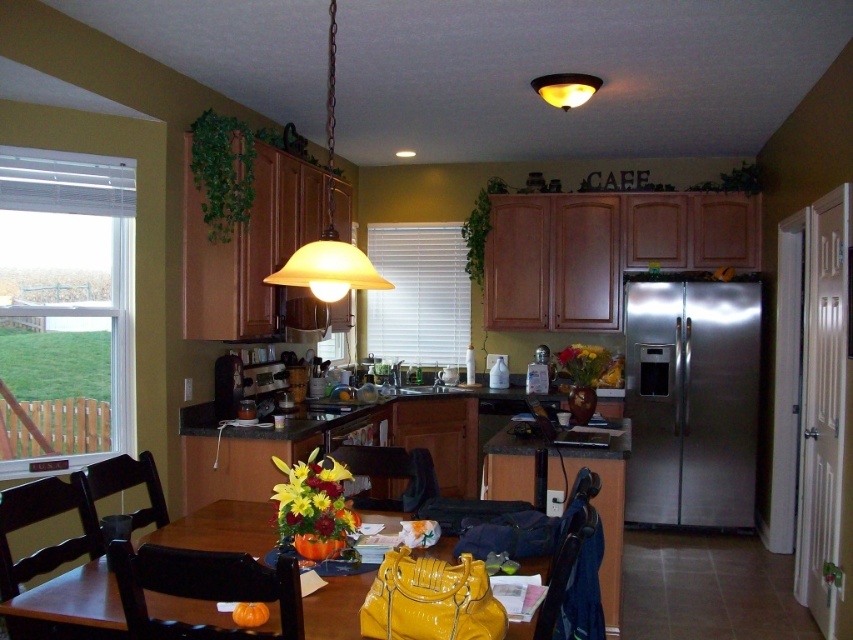
Question: Is matte glass pendant light at upper center above black wood chair at left?

Choices:
 (A) no
 (B) yes

Answer: (B)

Question: Does matte glass pendant light at upper center have a larger size compared to matte yellow glass pendant light at upper center?

Choices:
 (A) no
 (B) yes

Answer: (B)

Question: Among these points, which one is nearest to the camera?

Choices:
 (A) (706, 465)
 (B) (396, 504)
 (C) (207, 554)

Answer: (C)

Question: Considering the relative positions of stainless steel refrigerator at right and dark wood chair at lower left in the image provided, where is stainless steel refrigerator at right located with respect to dark wood chair at lower left?

Choices:
 (A) below
 (B) above

Answer: (B)

Question: Which point is closer to the camera taking this photo?

Choices:
 (A) (62, 500)
 (B) (543, 614)
 (C) (589, 80)
 (D) (308, 280)

Answer: (B)

Question: Estimate the real-world distances between objects in this image. Which object is closer to the black leather chair at lower left?

Choices:
 (A) stainless steel refrigerator at right
 (B) matte black chair at lower center

Answer: (B)